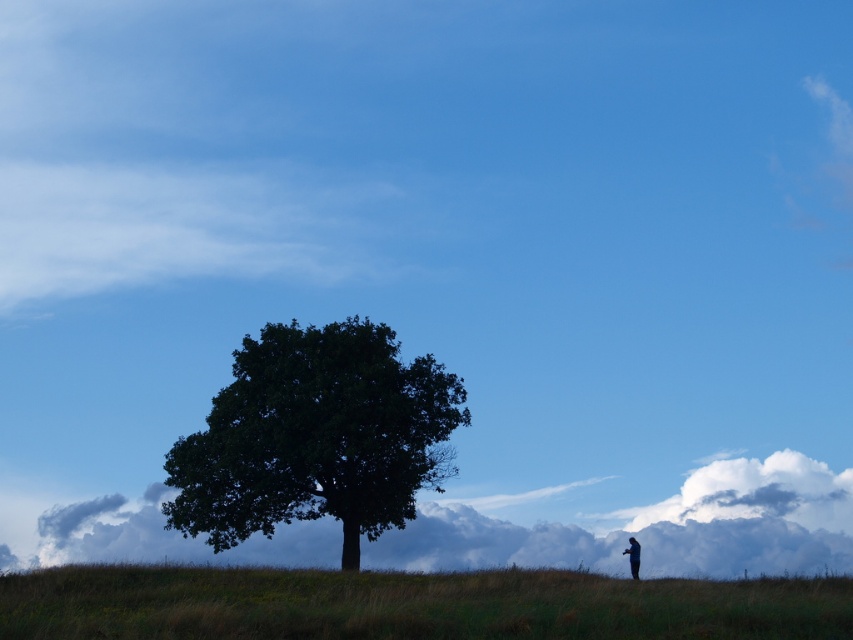
You are a photographer trying to capture the green leafy tree at center and the blue fabric person at lower right in the same frame. Based on their sizes in the image, which one do you think is closer to you?

The green leafy tree at center is smaller than the blue fabric person at lower right, which means the blue fabric person at lower right is closer to you since objects closer to the camera appear larger.

You are a photographer planning to take a photo of the green leafy tree at center and the blue fabric person at lower right. You want to ensure both subjects are in focus. Given that your camera has a depth of field that can cover up to 30 feet, will you be able to capture both subjects clearly in the same shot?

The green leafy tree at center and blue fabric person at lower right are 30.15 feet apart. Since the distance exceeds the camera lens depth of field limit of 30 feet, both subjects cannot be in focus simultaneously in the same shot.

You are a photographer positioned at the bottom of the image. You want to capture a shot that includes the green grassy hillside at lower center. According to the coordinates provided, where should you position your camera relative to the hillside to ensure it is centered in your frame?

The green grassy hillside at lower center is located at coordinates (410, 604). To center it in your frame, position your camera directly above or below this point so the hillside is at the center of your viewfinder.